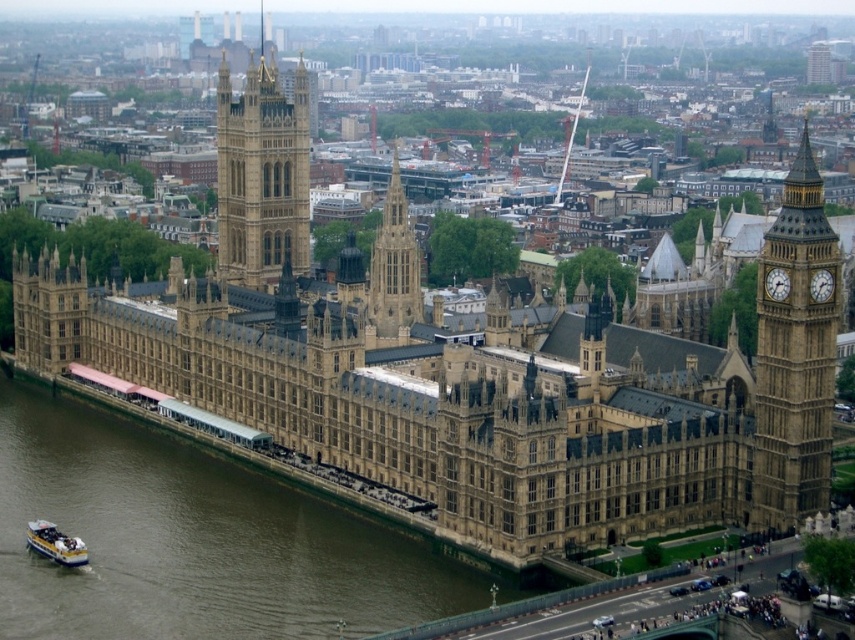
Does brown water at lower left have a larger size compared to stone clock tower at right?

Actually, brown water at lower left might be smaller than stone clock tower at right.

Between point (302, 509) and point (799, 328), which one is positioned behind?

The point (302, 509) is behind.

Does point (137, 506) come closer to viewer compared to point (815, 234)?

No, it is behind (815, 234).

I want to click on brown water at lower left, so click(x=193, y=541).

From the picture: Is brown water at lower left bigger than gold metallic clock at right?

Yes.

Is point (302, 630) less distant than point (770, 268)?

That is True.

The width and height of the screenshot is (855, 640). What are the coordinates of `brown water at lower left` in the screenshot? It's located at (193, 541).

Describe the element at coordinates (794, 356) in the screenshot. I see `stone clock tower at right` at that location.

Is point (762, 273) positioned in front of point (54, 541)?

No.

Between point (795, 259) and point (52, 538), which one is positioned behind?

Positioned behind is point (52, 538).

Where is `stone clock tower at right`? stone clock tower at right is located at coordinates (794, 356).